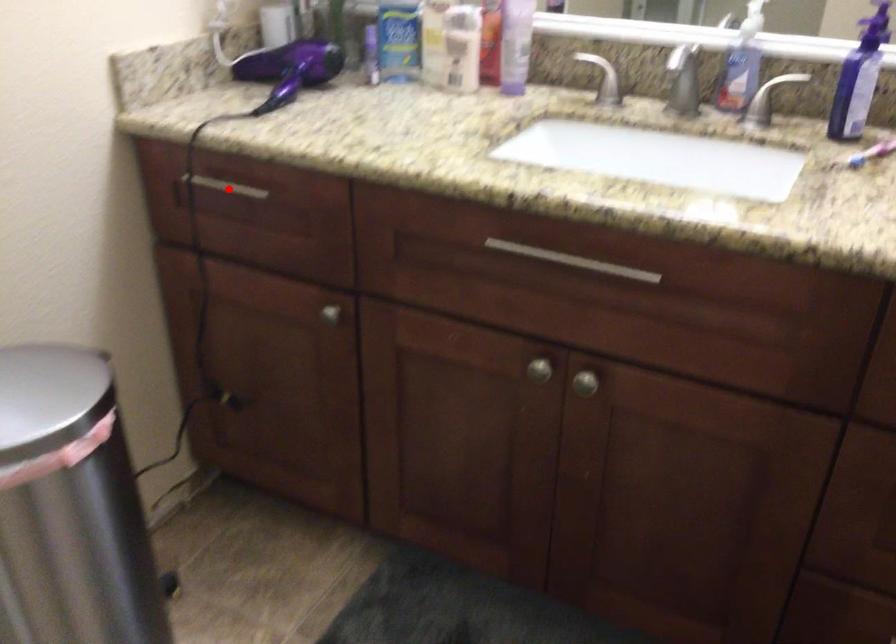
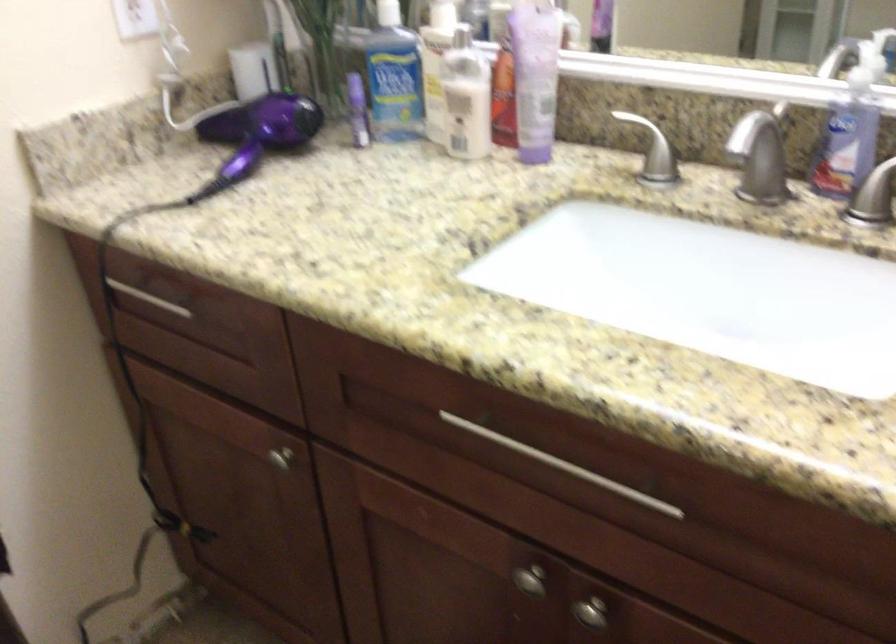
Question: I am providing you with two images of the same scene from different viewpoints. Given a red point in image1, look at the same physical point in image2. Is it:

Choices:
 (A) Closer to the viewpoint
 (B) Farther from the viewpoint

Answer: (A)